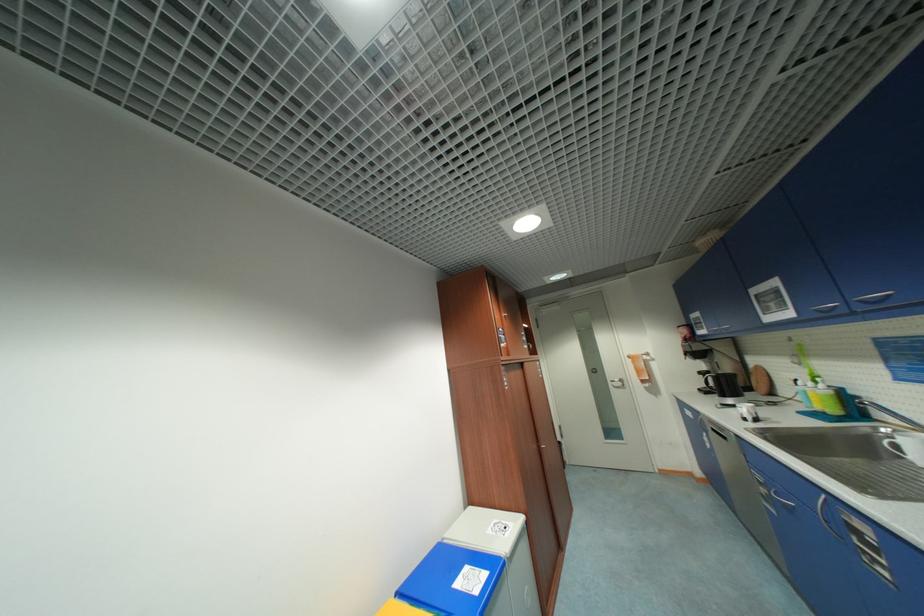
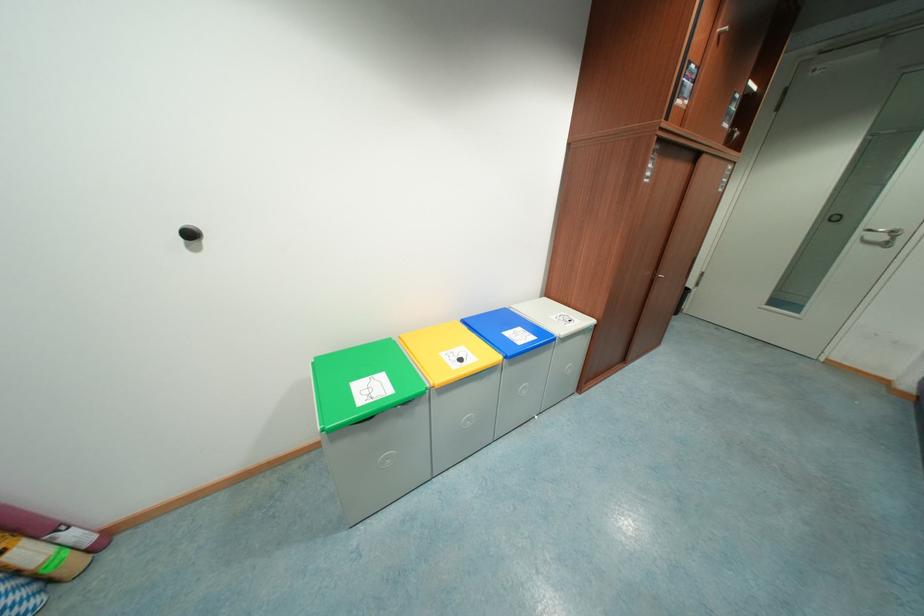
Based on the photo, first-person continuous shooting, in which direction is the camera rotating?

The camera's rotation is toward left-down.